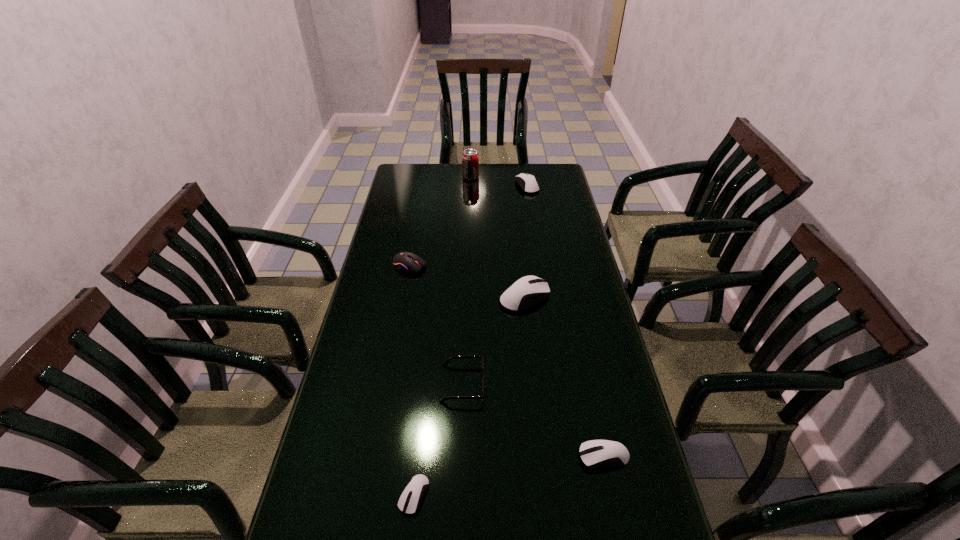
The height and width of the screenshot is (540, 960). Find the location of `free space between the second object from left to right and the fourth tallest mouse`. free space between the second object from left to right and the fourth tallest mouse is located at coordinates (509, 476).

This screenshot has width=960, height=540. I want to click on free space between the black computer mouse and the sunglasses, so click(436, 325).

The image size is (960, 540). Identify the location of free space between the fourth farthest object and the second smallest white mouse. (564, 376).

Identify the location of object that is the fourth closest to the farthest white mouse. (447, 361).

The image size is (960, 540). I want to click on the fifth closest object to the second smallest white mouse, so click(x=529, y=185).

Choose which mouse is the third nearest neighbor to the black computer mouse. Please provide its 2D coordinates. Your answer should be formatted as a tuple, i.e. [(x, y)], where the tuple contains the x and y coordinates of a point satisfying the conditions above.

[(410, 499)]

Identify which mouse is located as the second nearest to the third nearest white mouse. Please provide its 2D coordinates. Your answer should be formatted as a tuple, i.e. [(x, y)], where the tuple contains the x and y coordinates of a point satisfying the conditions above.

[(596, 453)]

Identify which white mouse is located as the second nearest to the farthest mouse. Please provide its 2D coordinates. Your answer should be formatted as a tuple, i.e. [(x, y)], where the tuple contains the x and y coordinates of a point satisfying the conditions above.

[(596, 453)]

Locate which white mouse ranks fourth in proximity to the third nearest object. Please provide its 2D coordinates. Your answer should be formatted as a tuple, i.e. [(x, y)], where the tuple contains the x and y coordinates of a point satisfying the conditions above.

[(529, 185)]

Locate an element on the screen. vacant space that satisfies the following two spatial constraints: 1. on the front side of the fourth nearest object; 2. on the left side of the leftmost object is located at coordinates (404, 296).